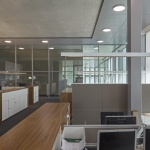
The image size is (150, 150). Find the location of `computer screen`. computer screen is located at coordinates click(109, 138).